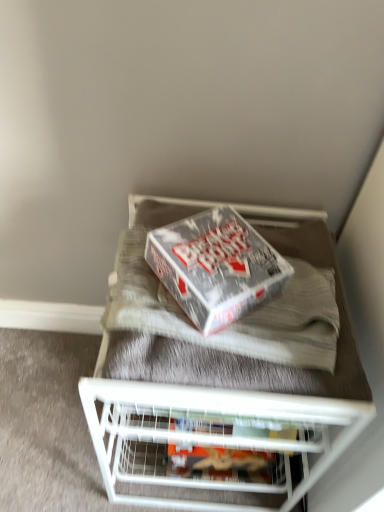
Question: Looking at the image, does silver metallic box at center seem bigger or smaller compared to white wire shelf at center?

Choices:
 (A) small
 (B) big

Answer: (A)

Question: Considering the positions of point (211, 328) and point (157, 436), is point (211, 328) closer or farther from the camera than point (157, 436)?

Choices:
 (A) closer
 (B) farther

Answer: (A)

Question: Based on their relative distances, which object is farther from the white wire shelf at center?

Choices:
 (A) silver metallic box at center
 (B) matte cardboard box at center
 (C) white metal shelf at upper center

Answer: (A)

Question: Which is nearer to the silver metallic box at center?

Choices:
 (A) matte cardboard box at center
 (B) white metal shelf at upper center
 (C) white wire shelf at center

Answer: (B)